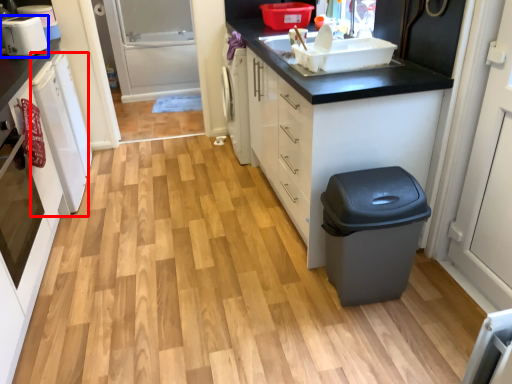
Question: Which object is closer to the camera taking this photo, dish washer (highlighted by a red box) or home appliance (highlighted by a blue box)?

Choices:
 (A) dish washer
 (B) home appliance

Answer: (A)